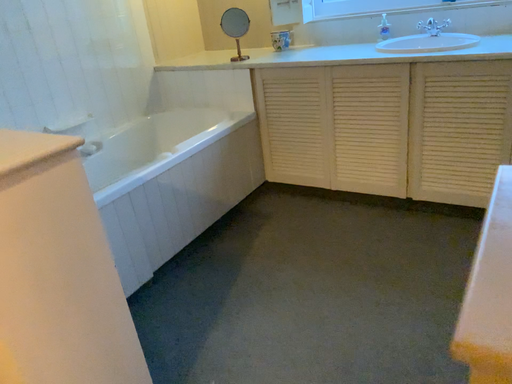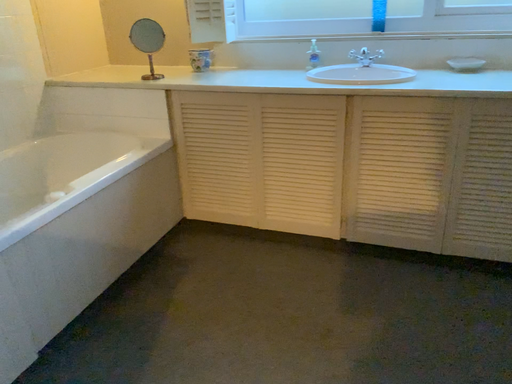
Question: Which way did the camera rotate in the video?

Choices:
 (A) rotated right
 (B) rotated left

Answer: (A)